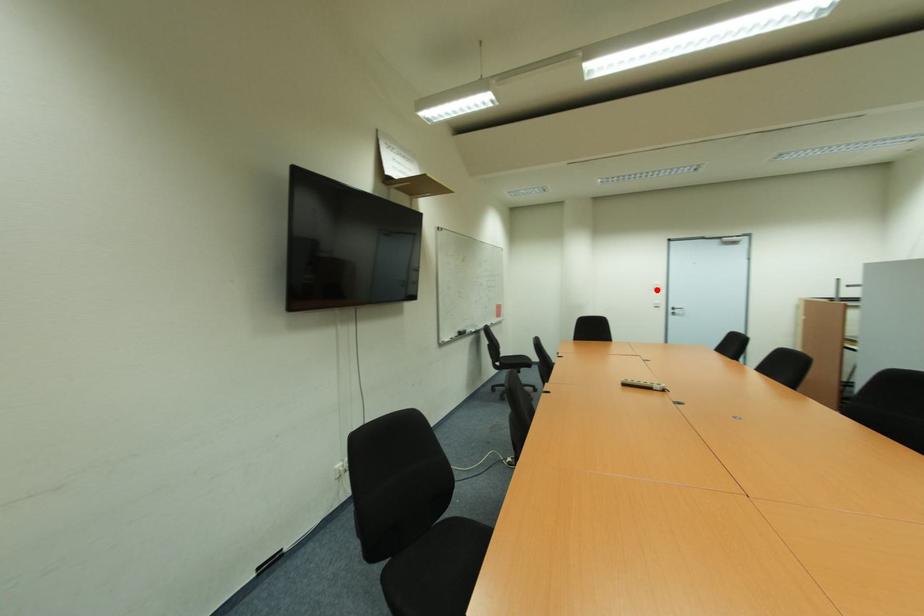
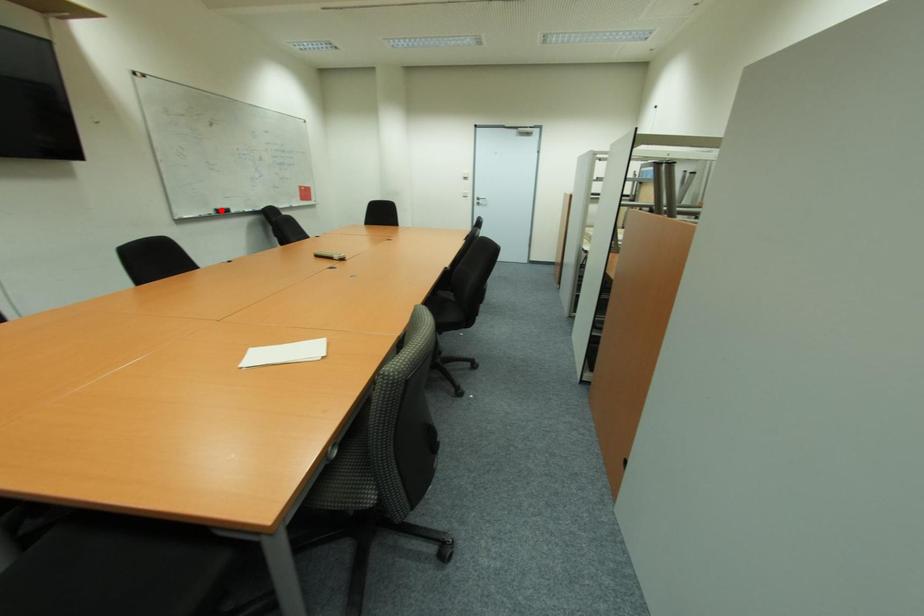
From the picture: I am providing you with two images of the same scene from different viewpoints. A red point is marked on the first image and another point is marked on the second image. Is the red point in image1 aligned with the point shown in image2?

No